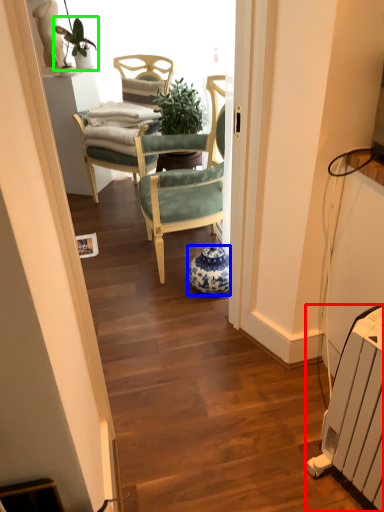
Question: Estimate the real-world distances between objects in this image. Which object is farther from radiator (highlighted by a red box), vase (highlighted by a blue box) or houseplant (highlighted by a green box)?

Choices:
 (A) vase
 (B) houseplant

Answer: (B)